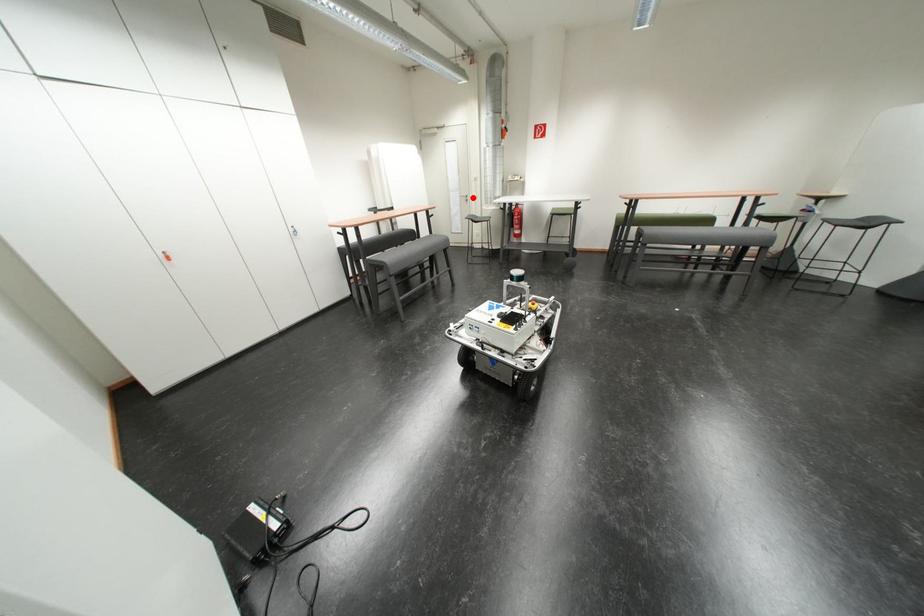
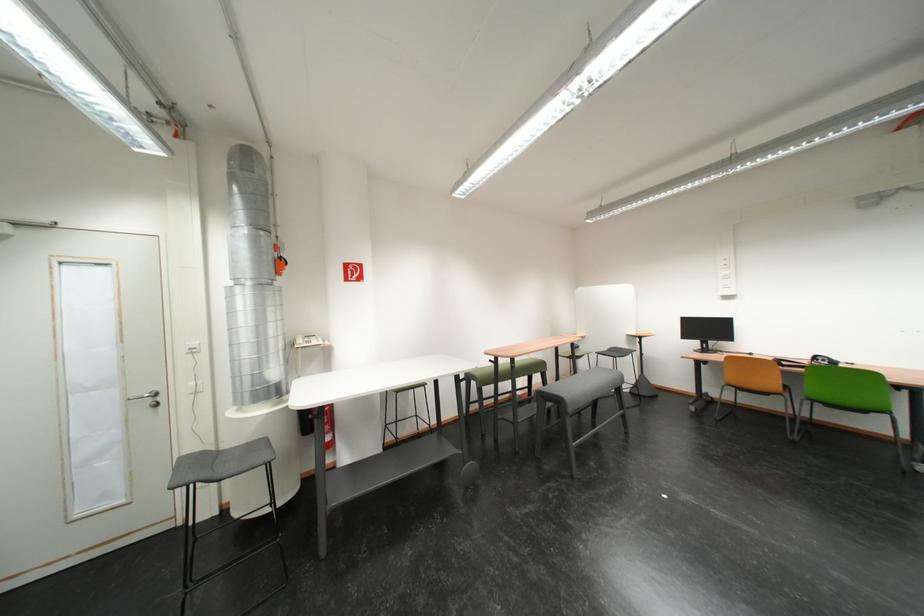
Question: I am providing you with two images of the same scene from different viewpoints. Given a red point in image1, look at the same physical point in image2. Is it:

Choices:
 (A) Closer to the viewpoint
 (B) Farther from the viewpoint

Answer: (B)